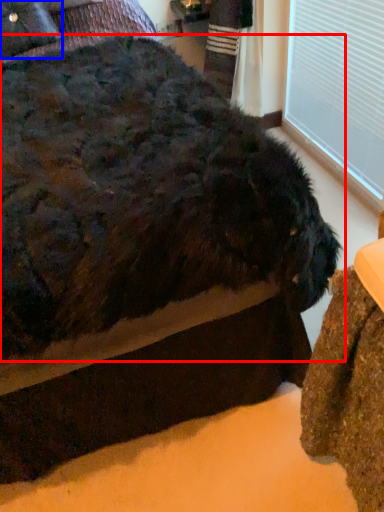
Question: Which point is further to the camera, dog (highlighted by a red box) or pillow (highlighted by a blue box)?

Choices:
 (A) dog
 (B) pillow

Answer: (B)